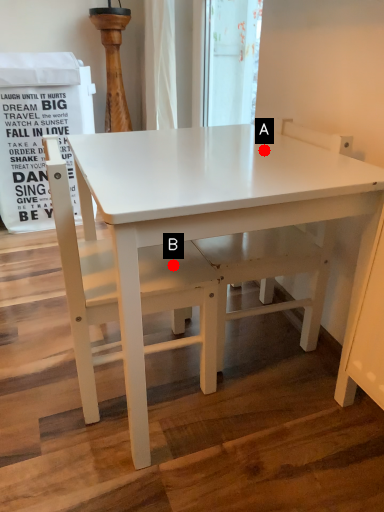
Question: Two points are circled on the image, labeled by A and B beside each circle. Which of the following is the farthest from the observer?

Choices:
 (A) A is further
 (B) B is further

Answer: (B)